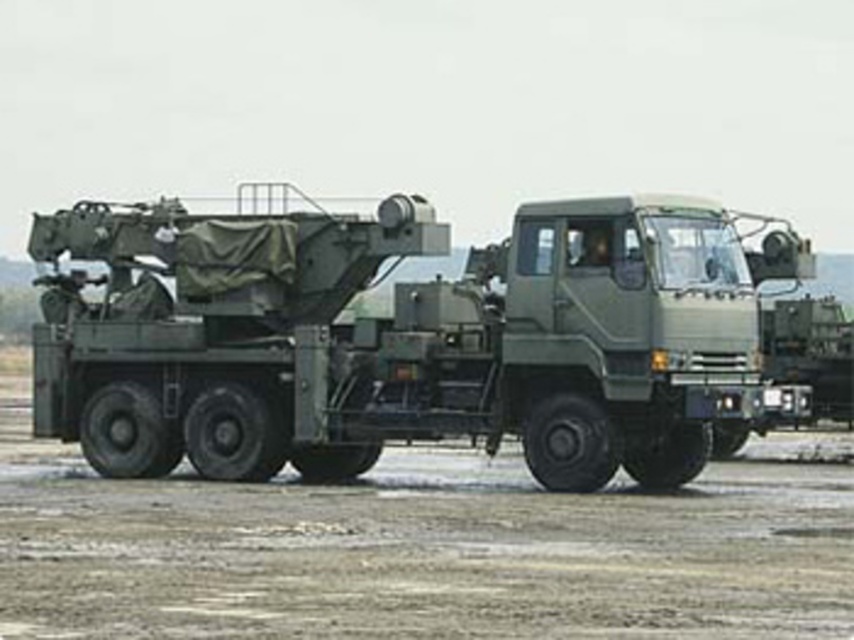
Question: Does matte green truck at center have a lesser width compared to dirt field at center?

Choices:
 (A) no
 (B) yes

Answer: (A)

Question: Is matte green truck at center behind dirt field at center?

Choices:
 (A) no
 (B) yes

Answer: (B)

Question: Where is matte green truck at center located in relation to dirt field at center in the image?

Choices:
 (A) below
 (B) above

Answer: (B)

Question: Which of the following is the closest to the observer?

Choices:
 (A) dirt field at center
 (B) matte green truck at center

Answer: (A)

Question: Which of the following is the farthest from the observer?

Choices:
 (A) (361, 428)
 (B) (843, 497)

Answer: (A)